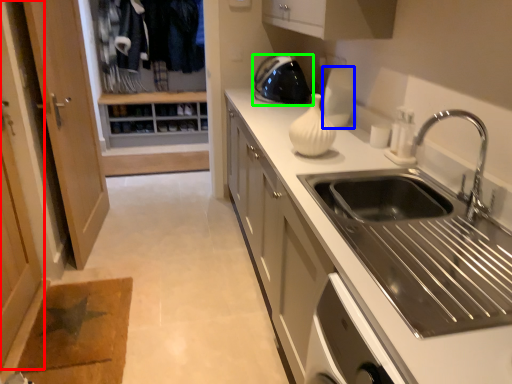
Question: Which object is the farthest from screen door (highlighted by a red box)? Choose among these: appliance (highlighted by a blue box) or home appliance (highlighted by a green box).

Choices:
 (A) appliance
 (B) home appliance

Answer: (A)